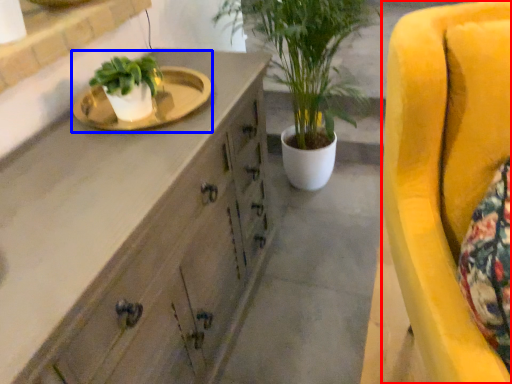
Question: Which object appears closest to the camera in this image, chair (highlighted by a red box) or sink (highlighted by a blue box)?

Choices:
 (A) chair
 (B) sink

Answer: (A)